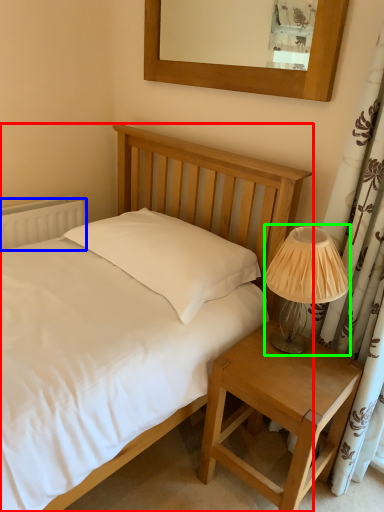
Question: Considering the real-world distances, which object is farthest from bed (highlighted by a red box)? radiator (highlighted by a blue box) or table lamp (highlighted by a green box)?

Choices:
 (A) radiator
 (B) table lamp

Answer: (A)